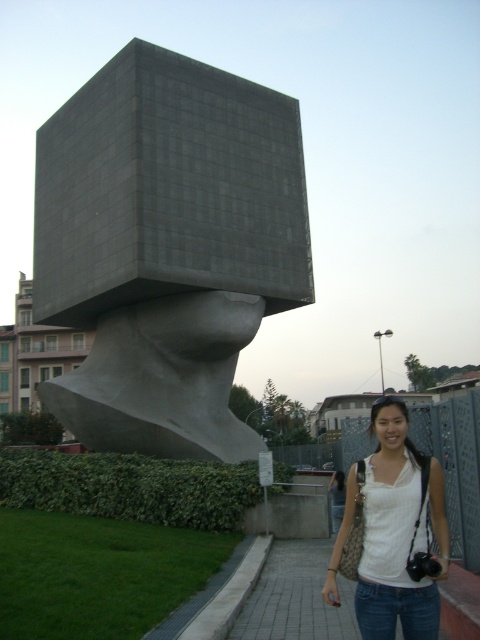
You are a tourist visiting the sculpture and want to take a photo of the matte gray cube at center from the paved stone sidewalk at lower center. Can you see the entire cube in your photo if you stand on the sidewalk?

The paved stone sidewalk at lower center is behind the matte gray cube at center, so standing on the sidewalk would place you behind the cube. This means the cube would be between you and the camera, making it impossible to see the entire cube in the photo.

You are standing at the entrance of the art installation and see the sculpture with a cube on top. The cube is represented by the point at coordinates (167,248). If you want to take a photo of the cube from the front, which direction should you face relative to the sculpture?

To take a photo of the cube from the front, you should face the direction where the point at coordinates (167,248) is centered in your view, which corresponds to the front of the sculpture.